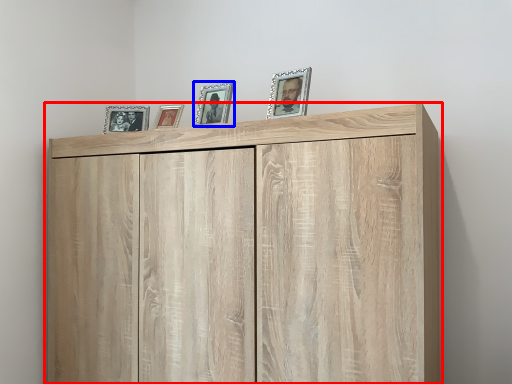
Question: Which object appears farthest to the camera in this image, cupboard (highlighted by a red box) or picture frame (highlighted by a blue box)?

Choices:
 (A) cupboard
 (B) picture frame

Answer: (B)